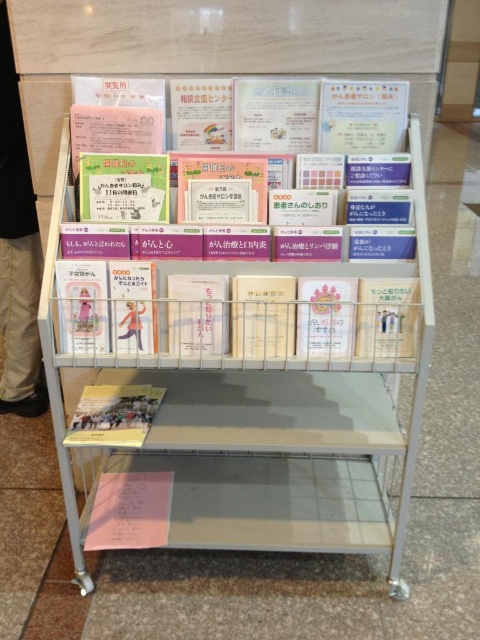
Question: Observing the image, what is the correct spatial positioning of matte plastic book at center in reference to yellow paper book at lower left?

Choices:
 (A) right
 (B) left

Answer: (A)

Question: Can you confirm if white paper book at center is bigger than white paper book at right?

Choices:
 (A) yes
 (B) no

Answer: (A)

Question: Among these points, which one is farthest from the camera?

Choices:
 (A) (217, 288)
 (B) (21, 387)
 (C) (257, 349)
 (D) (414, 321)

Answer: (B)

Question: Which point is closer to the camera?

Choices:
 (A) white paper book at right
 (B) yellow paper book at lower left
 (C) khaki pants at left

Answer: (A)

Question: Is metallic white bookshelf at center thinner than matte plastic book at center?

Choices:
 (A) yes
 (B) no

Answer: (B)

Question: Which object is closer to the camera taking this photo?

Choices:
 (A) khaki pants at left
 (B) matte plastic book at center
 (C) white paper book at right
 (D) metallic white bookshelf at center

Answer: (D)